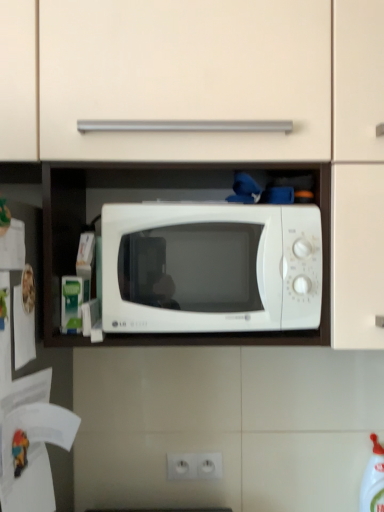
What do you see at coordinates (210, 268) in the screenshot?
I see `white matte microwave at center` at bounding box center [210, 268].

This screenshot has width=384, height=512. Identify the location of white matte microwave at center. (210, 268).

The height and width of the screenshot is (512, 384). Identify the location of white matte microwave at center. (210, 268).